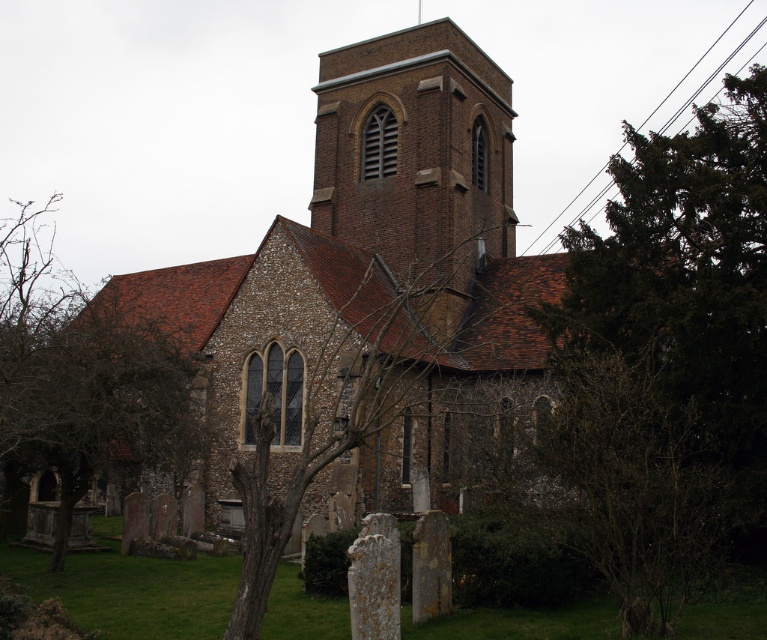
Is brown brick tower at center to the right of green leafy tree at lower left from the viewer's perspective?

Yes, brown brick tower at center is to the right of green leafy tree at lower left.

Consider the image. Is brown brick tower at center further to the viewer compared to green leafy tree at lower left?

Yes, it is behind green leafy tree at lower left.

Locate an element on the screen. Image resolution: width=767 pixels, height=640 pixels. brown brick tower at center is located at coordinates (416, 156).

Can you confirm if brown stone church at center is positioned to the left of brown brick tower at center?

Indeed, brown stone church at center is positioned on the left side of brown brick tower at center.

Which is in front, point (416, 380) or point (426, 22)?

Point (416, 380)

Between point (341, 164) and point (394, 228), which one is positioned behind?

The point (341, 164) is more distant.

This screenshot has width=767, height=640. In order to click on brown stone church at center in this screenshot , I will do `click(372, 262)`.

Is brown stone church at center shorter than green leafy tree at lower left?

No.

Can you confirm if brown stone church at center is positioned to the right of green leafy tree at lower left?

Yes, brown stone church at center is to the right of green leafy tree at lower left.

Which is in front, point (426, 275) or point (150, 372)?

Point (150, 372)

Where is `brown stone church at center`? Image resolution: width=767 pixels, height=640 pixels. brown stone church at center is located at coordinates (372, 262).